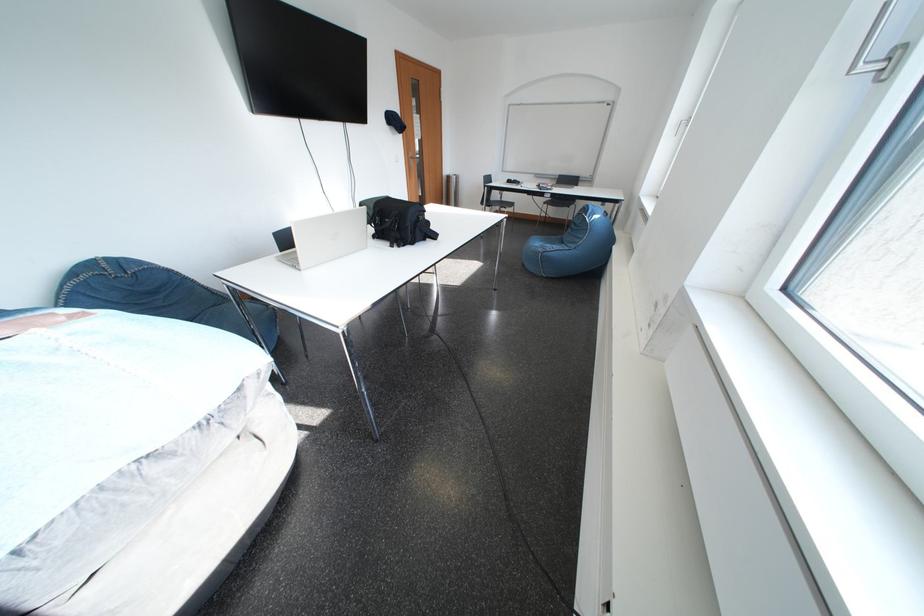
You are a GUI agent. You are given a task and a screenshot of the screen. Output one action in this format:
    pyautogui.click(x=<x>, y=<y>)
    Task: Click on the blue sofa sitting surface
    
    Given the screenshot: What is the action you would take?
    pyautogui.click(x=546, y=240)